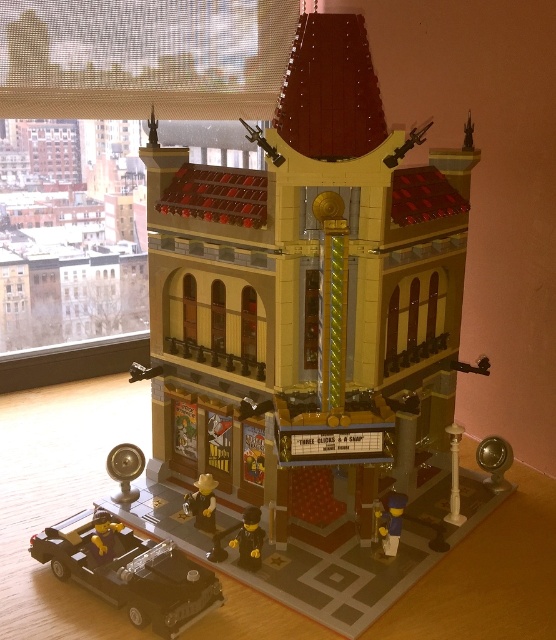
Measure the distance between black plastic car at lower left and camera.

black plastic car at lower left and camera are 36.29 inches apart.

Who is more distant from viewer, (214, 577) or (257, 547)?

Positioned behind is point (257, 547).

Does point (44, 552) come farther from viewer compared to point (242, 513)?

No, it is not.

Image resolution: width=556 pixels, height=640 pixels. Find the location of `black plastic car at lower left`. black plastic car at lower left is located at coordinates (128, 570).

Is matte yellow figure at center positioned behind yellow plastic car at lower left?

Yes, matte yellow figure at center is behind yellow plastic car at lower left.

Can you confirm if matte yellow figure at center is positioned to the right of yellow plastic car at lower left?

Indeed, matte yellow figure at center is positioned on the right side of yellow plastic car at lower left.

Does point (205, 509) lie in front of point (110, 548)?

No, it is not.

The image size is (556, 640). In order to click on matte yellow figure at center in this screenshot , I will do (x=201, y=502).

Does brick-like minifigure at center have a lesser width compared to yellow plastic car at lower left?

In fact, brick-like minifigure at center might be wider than yellow plastic car at lower left.

Does brick-like minifigure at center have a smaller size compared to yellow plastic car at lower left?

No.

Which is behind, point (245, 561) or point (101, 536)?

The point (245, 561) is more distant.

The height and width of the screenshot is (640, 556). I want to click on brick-like minifigure at center, so click(x=249, y=540).